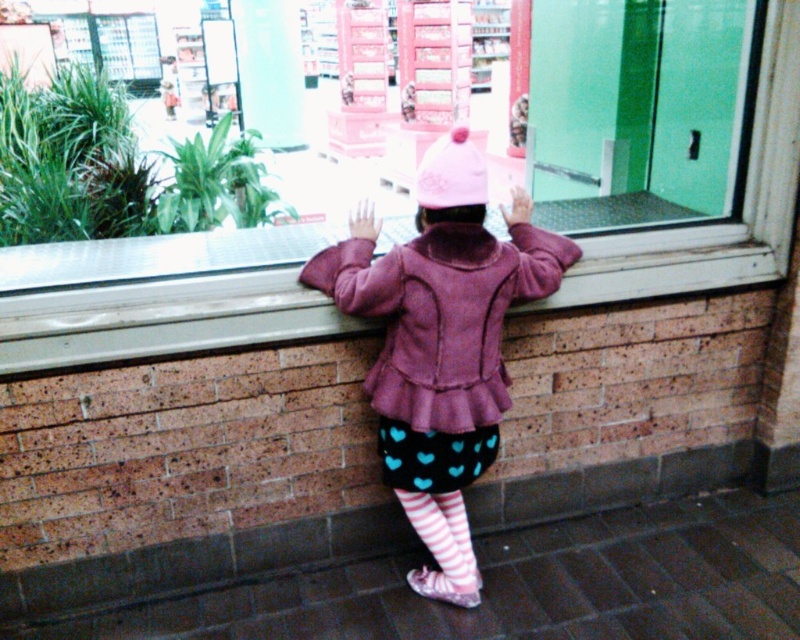
How far apart are purple fuzzy jacket at center and pink fabric hat at center?

A distance of 16.92 feet exists between purple fuzzy jacket at center and pink fabric hat at center.

Measure the distance between point (310, 260) and camera.

Point (310, 260) and camera are 1.98 meters apart.

Identify the location of purple fuzzy jacket at center. (441, 314).

Which is more to the right, smooth concrete window sill at center or striped cotton socks at lower center?

From the viewer's perspective, striped cotton socks at lower center appears more on the right side.

Which is in front, point (632, 282) or point (454, 552)?

Point (454, 552) is more forward.

Identify the location of smooth concrete window sill at center. click(x=166, y=330).

Consider the image. Can you confirm if smooth concrete window sill at center is smaller than pink fabric hat at center?

No.

Which is more to the left, smooth concrete window sill at center or pink fabric hat at center?

From the viewer's perspective, smooth concrete window sill at center appears more on the left side.

Who is more distant from viewer, (93, 352) or (424, 208)?

The point (93, 352) is more distant.

Locate an element on the screen. The width and height of the screenshot is (800, 640). smooth concrete window sill at center is located at coordinates (166, 330).